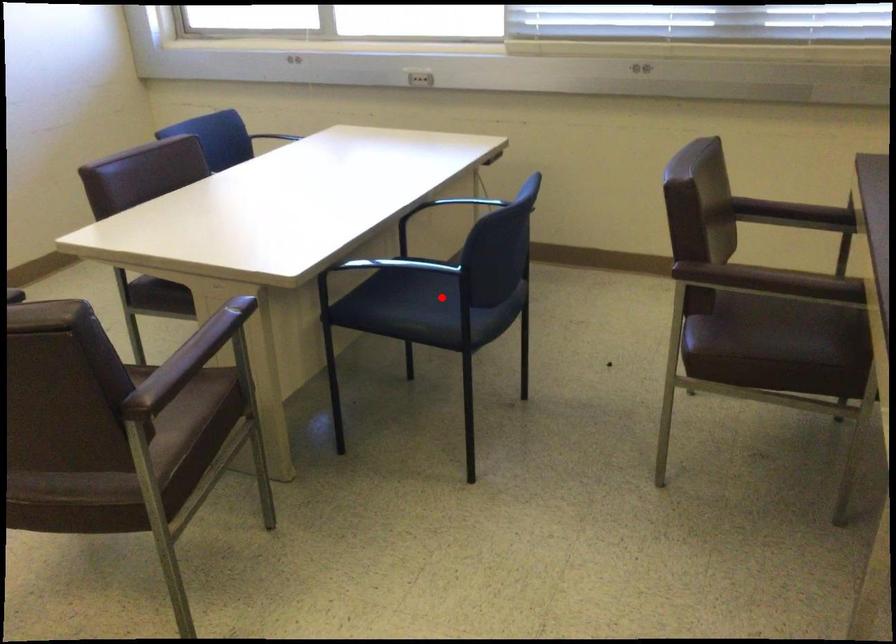
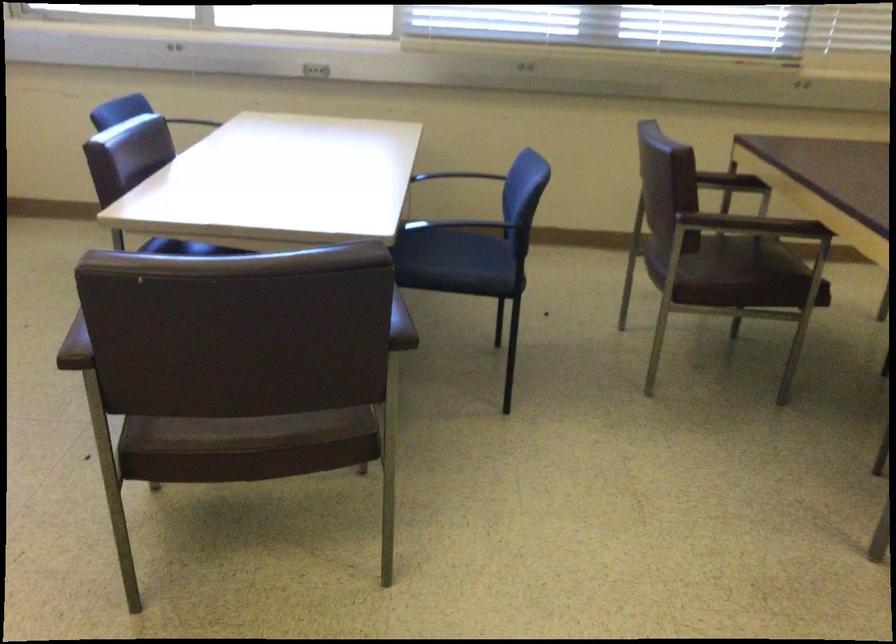
Question: A red point is marked in image1. In image2, is the corresponding 3D point closer to the camera or farther? Reply with the corresponding letter.

Choices:
 (A) The corresponding 3D point is closer.
 (B) The corresponding 3D point is farther.

Answer: (B)